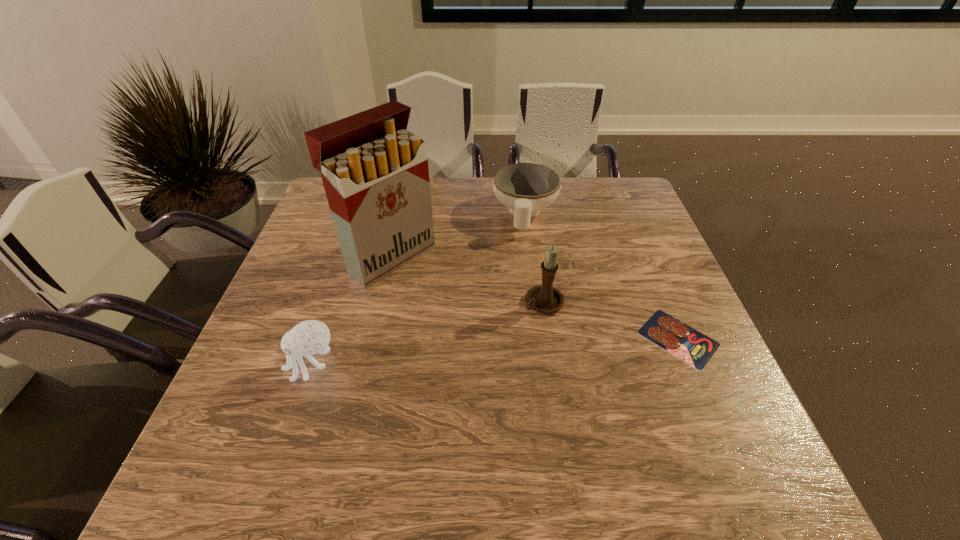
You are a GUI agent. You are given a task and a screenshot of the screen. Output one action in this format:
    pyautogui.click(x=<x>, y=<y>)
    Task: Click on the octopus
    Image resolution: width=960 pixels, height=540 pixels.
    Given the screenshot: What is the action you would take?
    pyautogui.click(x=309, y=337)

Locate an element on the screen. The width and height of the screenshot is (960, 540). the shortest object is located at coordinates (691, 346).

The image size is (960, 540). Find the location of `the rightmost object`. the rightmost object is located at coordinates click(x=691, y=346).

What are the coordinates of `cigarette case` in the screenshot? It's located at (375, 173).

You are a GUI agent. You are given a task and a screenshot of the screen. Output one action in this format:
    pyautogui.click(x=<x>, y=<y>)
    Task: Click on the fourth tallest object
    
    Given the screenshot: What is the action you would take?
    pyautogui.click(x=526, y=188)

Where is `the fourth shortest object`? the fourth shortest object is located at coordinates (544, 298).

This screenshot has height=540, width=960. I want to click on free space located on the front-facing side of the octopus, so click(x=262, y=365).

Where is `vacant space situated on the front-facing side of the octopus`? The image size is (960, 540). vacant space situated on the front-facing side of the octopus is located at coordinates (257, 365).

Find the location of a particular element. free space located 0.100m on the left of the salami is located at coordinates (595, 338).

At what (x,y) coordinates should I click in order to perform the action: click on free space located with the lid open on the cigarette case. Please return your answer as a coordinate pair (x, y). The height and width of the screenshot is (540, 960). Looking at the image, I should click on (443, 295).